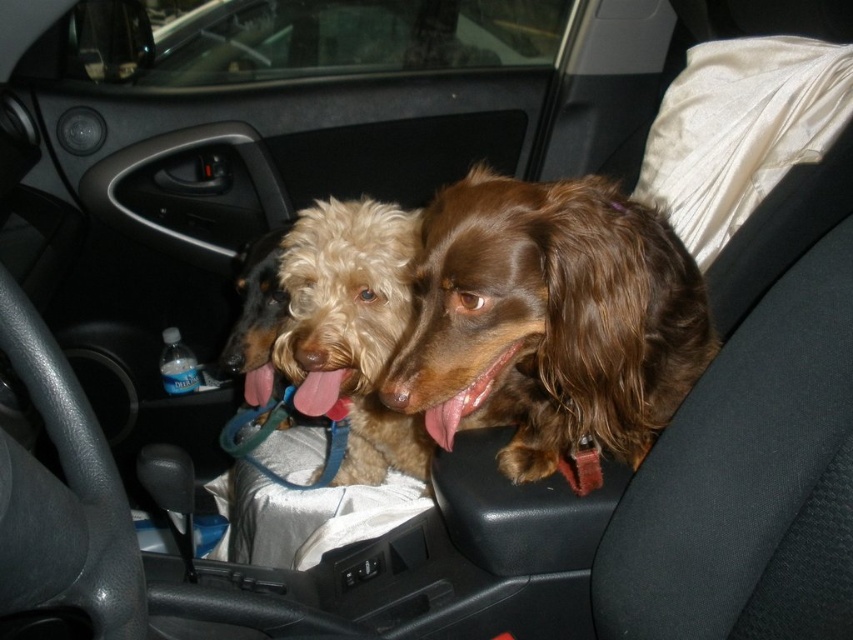
Question: Which point is farther from the camera taking this photo?

Choices:
 (A) (538, 248)
 (B) (379, 273)

Answer: (B)

Question: Is fuzzy brown dog at center positioned in front of pink glossy tongue at center?

Choices:
 (A) yes
 (B) no

Answer: (B)

Question: In this image, where is brown silky dog at center located relative to pink glossy tongue at center?

Choices:
 (A) below
 (B) above

Answer: (B)

Question: Which object is farther from the camera taking this photo?

Choices:
 (A) pink glossy tongue at center
 (B) fuzzy brown dog at center
 (C) brown silky dog at center

Answer: (B)

Question: Is brown silky dog at center to the left of pink glossy tongue at center from the viewer's perspective?

Choices:
 (A) no
 (B) yes

Answer: (A)

Question: Which object is farther from the camera taking this photo?

Choices:
 (A) brown silky dog at center
 (B) pink glossy tongue at center
 (C) fuzzy brown dog at center

Answer: (C)